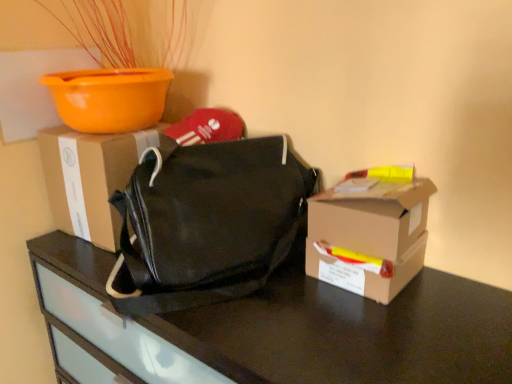
Identify the location of empty space that is ontop of black matte bag at center (from a real-world perspective). (297, 307).